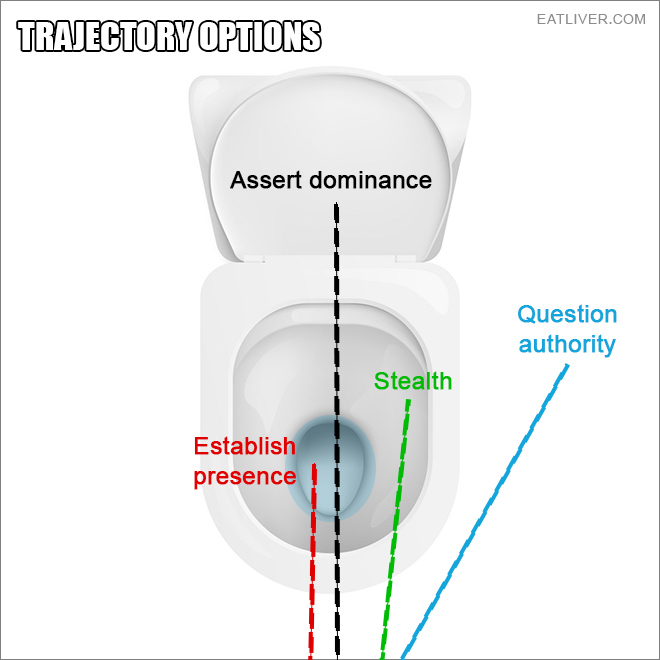
Where is `bowl`? This screenshot has width=660, height=660. bowl is located at coordinates (273, 376).